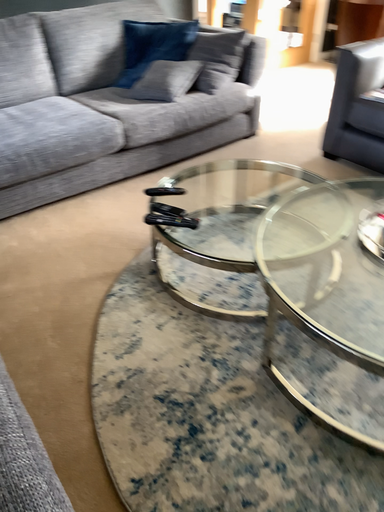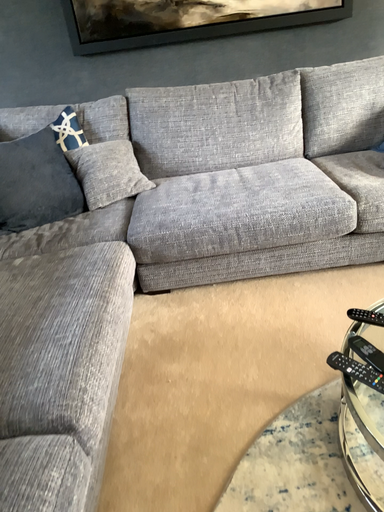
Question: Which way did the camera rotate in the video?

Choices:
 (A) rotated left
 (B) rotated right

Answer: (A)